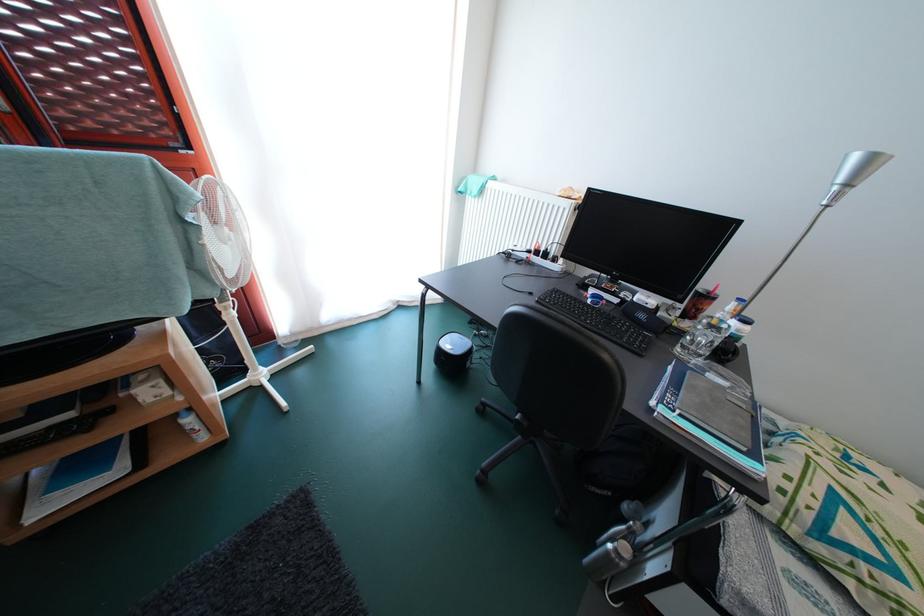
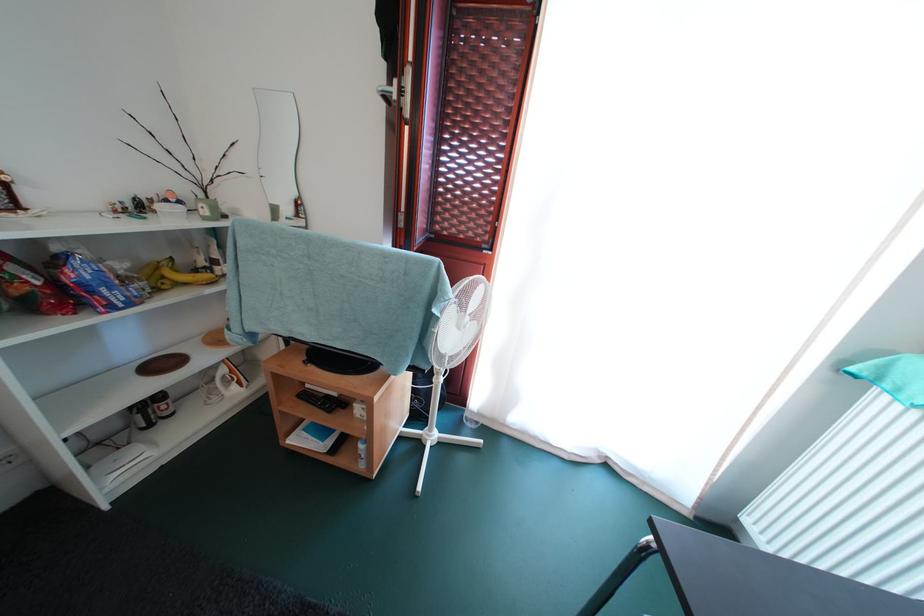
Question: Based on the continuous images, in which direction is the camera rotating? Reply with the corresponding letter.

Choices:
 (A) Left
 (B) Right
 (C) Up
 (D) Down

Answer: (A)